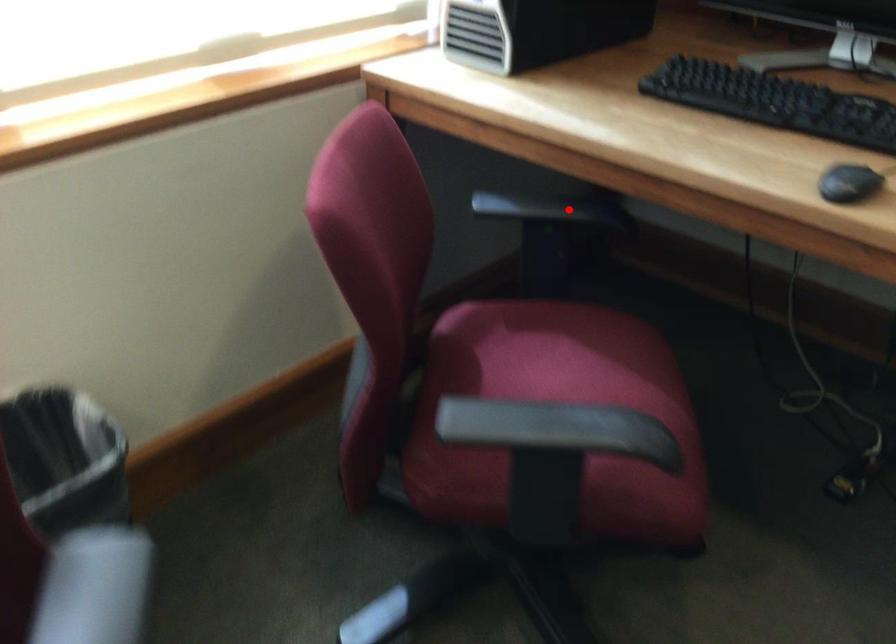
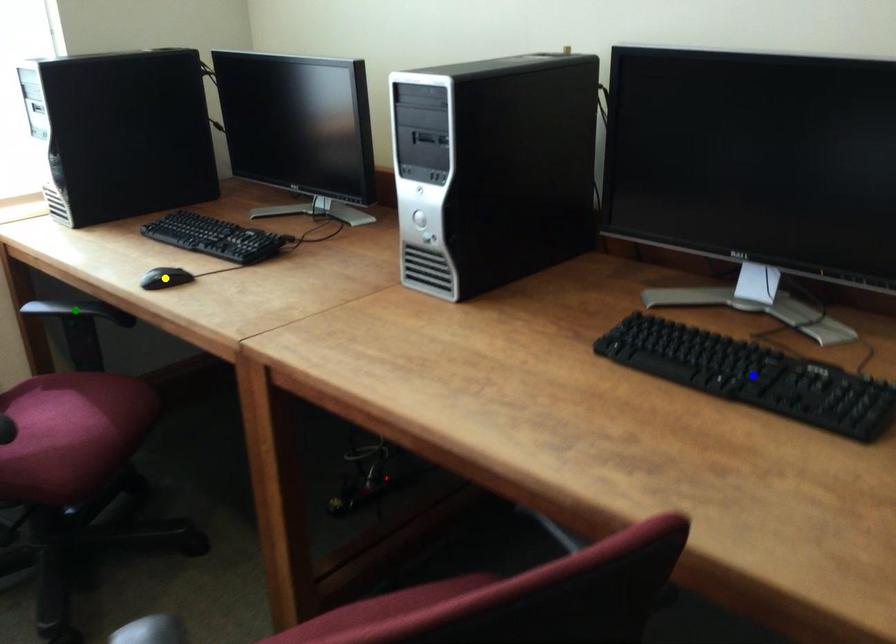
Question: I am providing you with two images of the same scene from different viewpoints. A red point is marked on the first image. You are given multiple points on the second image. Can you choose the point in image 2 that corresponds to the point in image 1?

Choices:
 (A) blue point
 (B) green point
 (C) yellow point

Answer: (B)